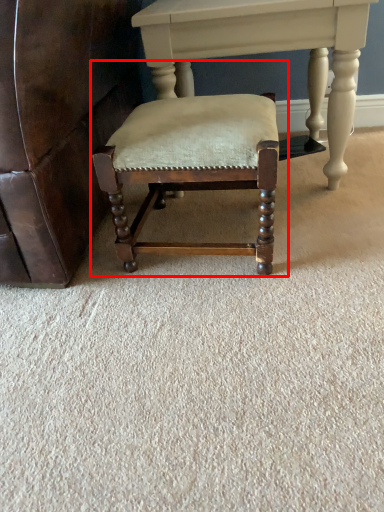
Question: From the image's perspective, where is chair (annotated by the red box) located in relation to table in the image?

Choices:
 (A) below
 (B) above

Answer: (A)